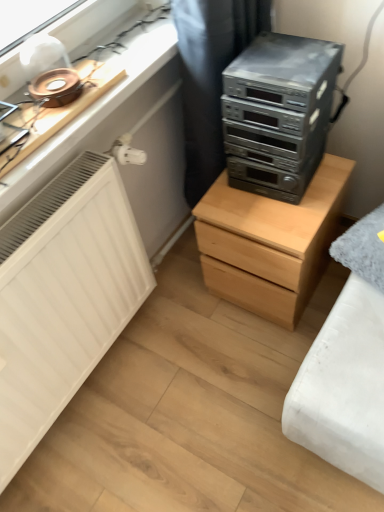
The height and width of the screenshot is (512, 384). I want to click on free space in front of satin black stereo at upper right, so click(281, 216).